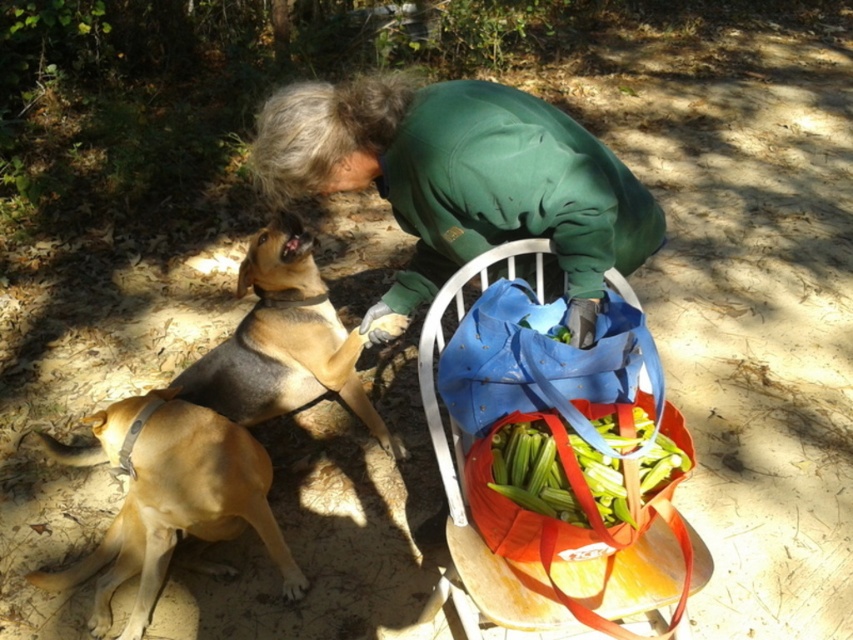
Question: Can you confirm if wooden chair at lower center is positioned below green leafy vegetables at lower center?

Choices:
 (A) yes
 (B) no

Answer: (A)

Question: Does green fleece jacket at center appear over blue fabric bag at lower right?

Choices:
 (A) no
 (B) yes

Answer: (B)

Question: Which of these objects is positioned farthest from the green fleece jacket at center?

Choices:
 (A) golden fur dog at lower left
 (B) green leafy vegetables at lower center

Answer: (A)

Question: Which is farther from the golden fur dog at lower left?

Choices:
 (A) brown fur dog at lower left
 (B) green fleece jacket at center
 (C) wooden chair at lower center
 (D) blue fabric bag at lower right

Answer: (D)

Question: Can you confirm if blue fabric bag at lower right is smaller than green leafy vegetables at lower center?

Choices:
 (A) yes
 (B) no

Answer: (B)

Question: Which object is positioned farthest from the brown fur dog at lower left?

Choices:
 (A) wooden chair at lower center
 (B) golden fur dog at lower left

Answer: (A)